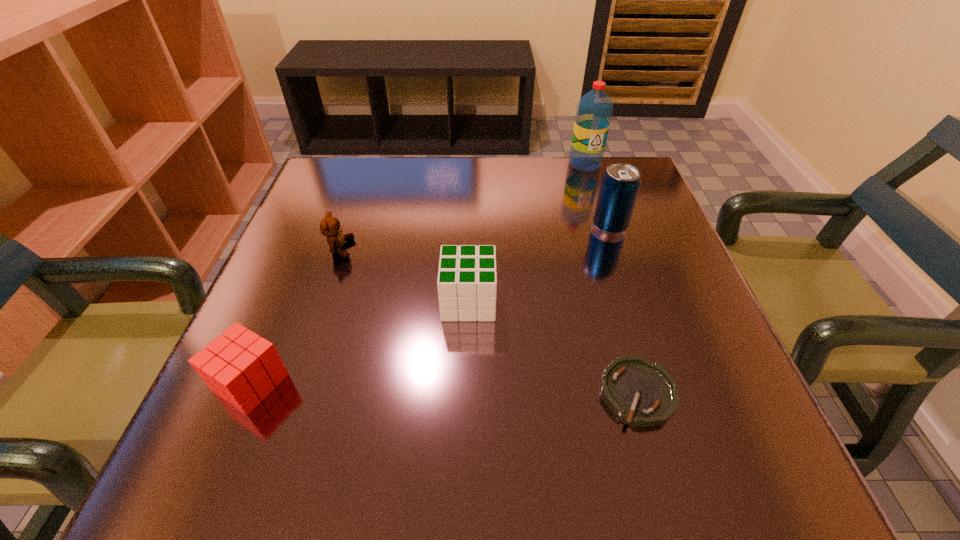
This screenshot has height=540, width=960. In order to click on free spot located 0.390m on the front of the soda can in this screenshot , I will do `click(669, 406)`.

Where is `free location located on the red face of the fourth object from right to left`? The height and width of the screenshot is (540, 960). free location located on the red face of the fourth object from right to left is located at coordinates (583, 301).

The image size is (960, 540). Identify the location of free space located on the front-facing side of the teddy bear. (430, 248).

Identify the location of free space located 0.210m on the right of the left cube. The width and height of the screenshot is (960, 540). (421, 383).

You are a GUI agent. You are given a task and a screenshot of the screen. Output one action in this format:
    pyautogui.click(x=<x>, y=<y>)
    Task: Click on the free space located on the back of the shortest object
    The image size is (960, 540).
    Given the screenshot: What is the action you would take?
    pyautogui.click(x=618, y=323)

Locate an element on the screen. The width and height of the screenshot is (960, 540). object present at the far edge is located at coordinates (594, 111).

The height and width of the screenshot is (540, 960). I want to click on object present at the near edge, so click(643, 393).

Find the location of `teddy bear positioned at the left edge`. teddy bear positioned at the left edge is located at coordinates (330, 226).

Where is `cube present at the left edge`? The image size is (960, 540). cube present at the left edge is located at coordinates (241, 367).

Where is `water bottle at the right edge`? water bottle at the right edge is located at coordinates (594, 111).